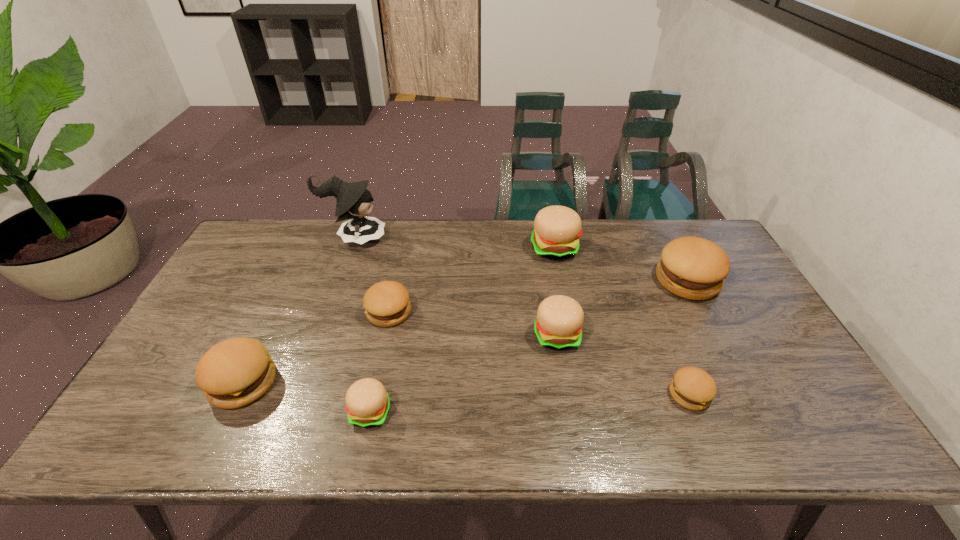
I want to click on the second closest beige hamburger to the biggest brown hamburger, so [x=558, y=325].

Select which beige hamburger appears as the second closest to the second biggest beige hamburger. Please provide its 2D coordinates. Your answer should be formatted as a tuple, i.e. [(x, y)], where the tuple contains the x and y coordinates of a point satisfying the conditions above.

[(367, 403)]

This screenshot has width=960, height=540. I want to click on brown hamburger that stands as the third closest to the third biggest brown hamburger, so click(693, 268).

In order to click on brown hamburger object that ranks as the closest to the biggest beige hamburger in this screenshot , I will do `click(693, 268)`.

The height and width of the screenshot is (540, 960). In order to click on vacant point that satisfies the following two spatial constraints: 1. on the back side of the biggest brown hamburger; 2. at the face of the doll in this screenshot , I will do `click(665, 238)`.

Where is `vacant area in the image that satisfies the following two spatial constraints: 1. on the back side of the second farthest beige hamburger; 2. on the left side of the smallest beige hamburger`? Image resolution: width=960 pixels, height=540 pixels. vacant area in the image that satisfies the following two spatial constraints: 1. on the back side of the second farthest beige hamburger; 2. on the left side of the smallest beige hamburger is located at coordinates (386, 335).

In order to click on vacant region that satisfies the following two spatial constraints: 1. on the front side of the farthest beige hamburger; 2. on the left side of the biggest brown hamburger in this screenshot , I will do `click(561, 280)`.

What are the coordinates of `vacant area in the image that satisfies the following two spatial constraints: 1. at the face of the tallest object; 2. on the left side of the smallest beige hamburger` in the screenshot? It's located at (294, 411).